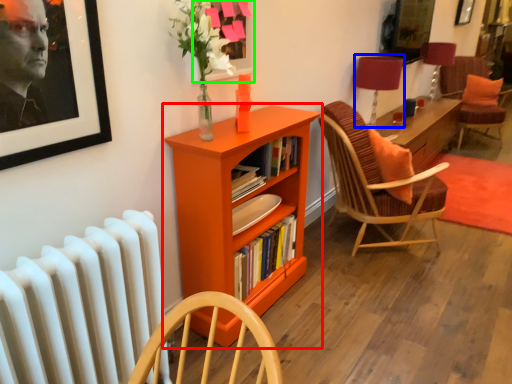
Question: Which is farther away from bookcase (highlighted by a red box)? table lamp (highlighted by a blue box) or picture frame (highlighted by a green box)?

Choices:
 (A) table lamp
 (B) picture frame

Answer: (A)